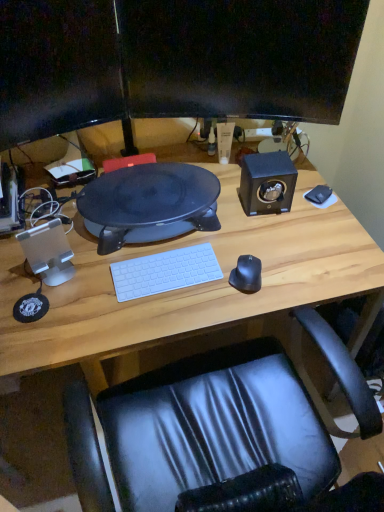
The image size is (384, 512). In order to click on vacant space behind white matte keyboard at center in this screenshot , I will do click(178, 238).